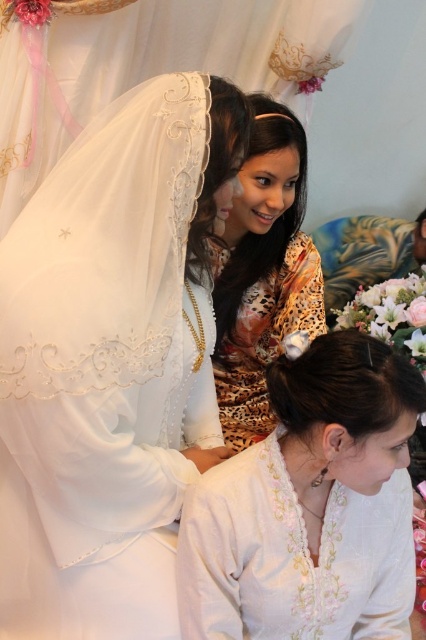
You are a photographer at a wedding event and need to capture a photo of both the white floral blouse at lower center and the leopard print dress at center. Based on their positions, which one is located lower in the image?

The white floral blouse at lower center is located lower in the image than the leopard print dress at center.

You are attending a wedding and need to decide which outfit to wear. The venue has a dress code requiring the skirt length to be above the knee. You have two options from the image provided. Which one between the white floral blouse at lower center and the leopard print dress at center would be more appropriate?

The white floral blouse at lower center is shorter than the leopard print dress at center, so the white floral blouse at lower center would be more appropriate for the dress code requiring skirt length above the knee.

You are a photographer at a wedding event and need to capture a photo that includes both the white lace veil at upper left and the leopard print dress at center. Based on their positions, which object should you ensure stays within the left side of the frame?

The white lace veil at upper left should be positioned on the left side of the leopard print dress at center in the frame.